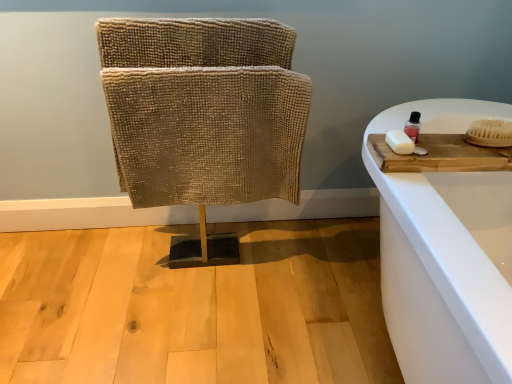
Question: Does white matte soap at right have a lesser width compared to transparent plastic bottle at upper right?

Choices:
 (A) no
 (B) yes

Answer: (A)

Question: From a real-world perspective, is white matte soap at right on transparent plastic bottle at upper right?

Choices:
 (A) yes
 (B) no

Answer: (B)

Question: From the image's perspective, does white matte soap at right appear lower than transparent plastic bottle at upper right?

Choices:
 (A) yes
 (B) no

Answer: (A)

Question: Is white matte soap at right with transparent plastic bottle at upper right?

Choices:
 (A) yes
 (B) no

Answer: (A)

Question: Is white matte soap at right looking in the opposite direction of transparent plastic bottle at upper right?

Choices:
 (A) yes
 (B) no

Answer: (A)

Question: From the image's perspective, does white matte soap at right appear higher than transparent plastic bottle at upper right?

Choices:
 (A) no
 (B) yes

Answer: (A)

Question: Is beige textured fabric at center to the left of wooden cutting board at right from the viewer's perspective?

Choices:
 (A) no
 (B) yes

Answer: (B)

Question: Considering the relative positions of beige textured fabric at center and wooden cutting board at right in the image provided, is beige textured fabric at center behind wooden cutting board at right?

Choices:
 (A) no
 (B) yes

Answer: (B)

Question: Considering the relative sizes of beige textured fabric at center and wooden cutting board at right in the image provided, is beige textured fabric at center wider than wooden cutting board at right?

Choices:
 (A) yes
 (B) no

Answer: (B)

Question: Can you confirm if beige textured fabric at center is taller than wooden cutting board at right?

Choices:
 (A) yes
 (B) no

Answer: (A)

Question: Does beige textured fabric at center have a lesser height compared to wooden cutting board at right?

Choices:
 (A) no
 (B) yes

Answer: (A)

Question: Is beige textured fabric at center next to wooden cutting board at right and touching it?

Choices:
 (A) yes
 (B) no

Answer: (B)

Question: Is transparent plastic bottle at upper right positioned before wooden cutting board at right?

Choices:
 (A) no
 (B) yes

Answer: (A)